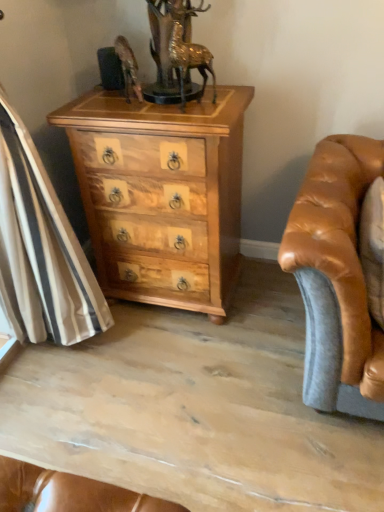
Locate an element on the screen. Image resolution: width=384 pixels, height=512 pixels. free point behind gold metallic deer at upper center is located at coordinates (201, 96).